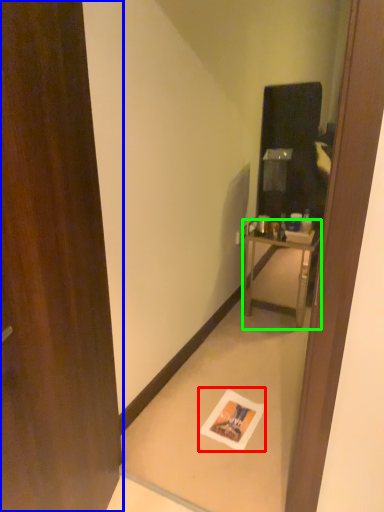
Question: Which is farther away from postcard (highlighted by a red box)? door (highlighted by a blue box) or nightstand (highlighted by a green box)?

Choices:
 (A) door
 (B) nightstand

Answer: (B)